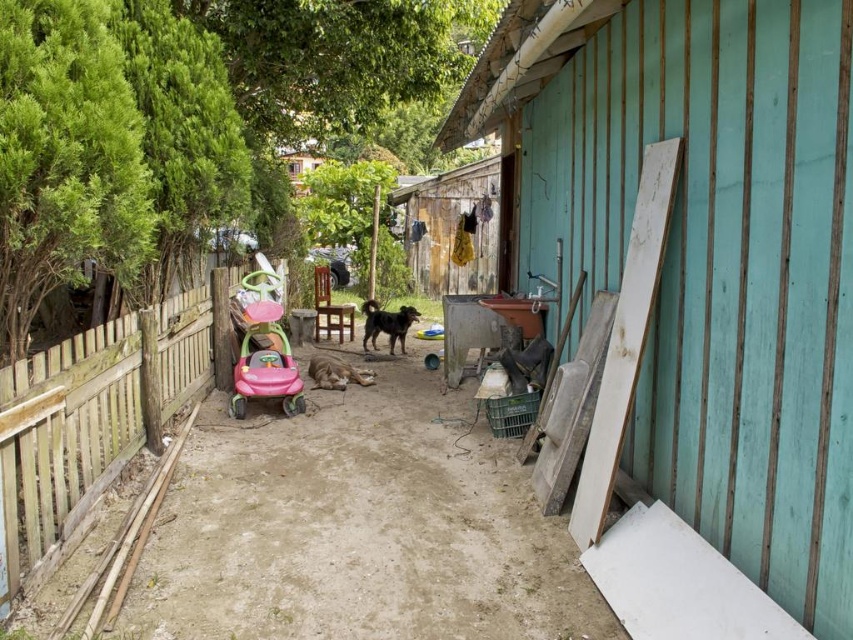
Question: Does wooden boards at right have a greater width compared to wooden fence at left?

Choices:
 (A) no
 (B) yes

Answer: (A)

Question: Does wooden fence at left come in front of pink plastic baby carriage at center?

Choices:
 (A) no
 (B) yes

Answer: (B)

Question: Which object is closer to the camera taking this photo?

Choices:
 (A) wooden fence at left
 (B) pink plastic baby carriage at center
 (C) wooden boards at right

Answer: (A)

Question: Considering the real-world distances, which object is closest to the wooden fence at left?

Choices:
 (A) wooden boards at right
 (B) pink plastic baby carriage at center

Answer: (B)

Question: Which point is closer to the camera?

Choices:
 (A) pink plastic baby carriage at center
 (B) wooden boards at right

Answer: (B)

Question: Does wooden boards at right have a greater width compared to wooden fence at left?

Choices:
 (A) yes
 (B) no

Answer: (B)